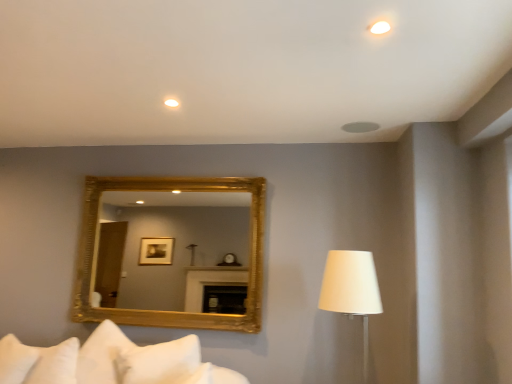
Image resolution: width=512 pixels, height=384 pixels. What are the coordinates of `free space to the right of white matte ceiling light at upper center, the first lighting in the bottom-to-top sequence` in the screenshot? It's located at (197, 99).